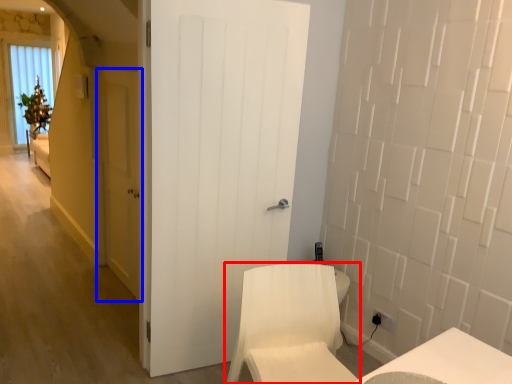
Question: Which point is further to the camera, furniture (highlighted by a red box) or door (highlighted by a blue box)?

Choices:
 (A) furniture
 (B) door

Answer: (B)